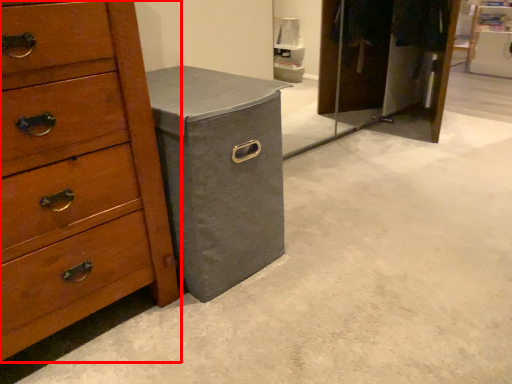
Question: From the image's perspective, where is chest of drawers (annotated by the red box) located relative to cabinetry?

Choices:
 (A) above
 (B) below

Answer: (B)